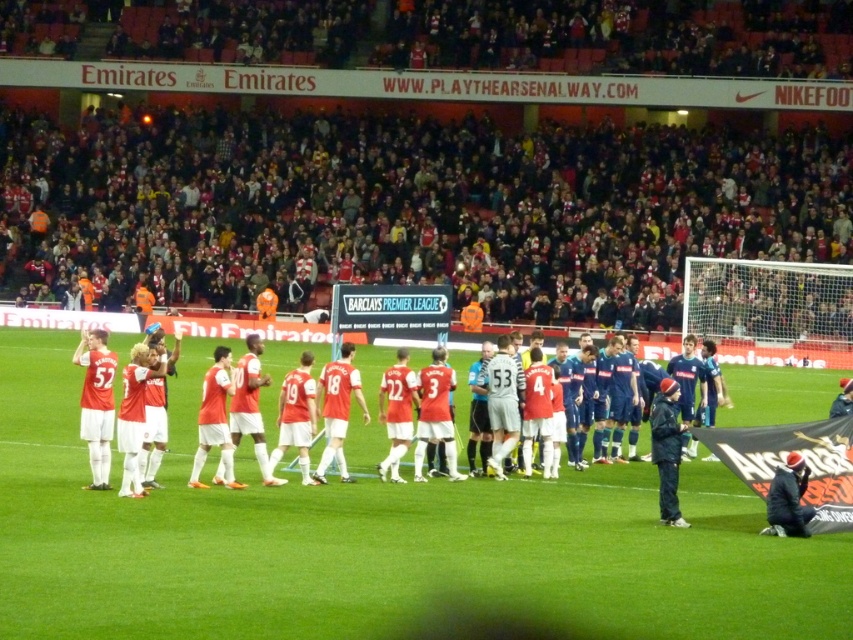
You are a drone operator trying to capture aerial footage of the football match. You need to ensure the camera focuses on the green grass field at center. Given the coordinates provided, can you confirm if the point at (375, 540) is the correct location to focus on?

Yes, the point at (375, 540) marks the green grass field at center, so focusing there will capture the desired area.